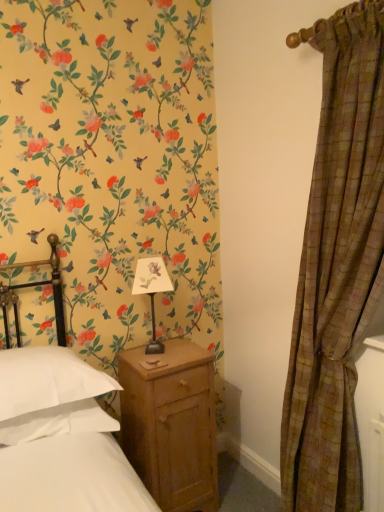
Question: Does white soft pillow at lower left turn towards matte black table lamp at center?

Choices:
 (A) yes
 (B) no

Answer: (B)

Question: Would you say white soft pillow at lower left contains matte black table lamp at center?

Choices:
 (A) no
 (B) yes

Answer: (A)

Question: Are white soft pillow at lower left and matte black table lamp at center located far from each other?

Choices:
 (A) no
 (B) yes

Answer: (A)

Question: From a real-world perspective, is white soft pillow at lower left located higher than matte black table lamp at center?

Choices:
 (A) yes
 (B) no

Answer: (B)

Question: Considering the relative sizes of white soft pillow at lower left and matte black table lamp at center in the image provided, is white soft pillow at lower left wider than matte black table lamp at center?

Choices:
 (A) no
 (B) yes

Answer: (B)

Question: In the image, is wooden nightstand at lower center positioned in front of or behind brown plaid curtain at right?

Choices:
 (A) behind
 (B) front

Answer: (A)

Question: Considering the positions of point (162, 412) and point (283, 431), is point (162, 412) closer or farther from the camera than point (283, 431)?

Choices:
 (A) farther
 (B) closer

Answer: (A)

Question: Based on their sizes in the image, would you say wooden nightstand at lower center is bigger or smaller than brown plaid curtain at right?

Choices:
 (A) small
 (B) big

Answer: (A)

Question: Considering the positions of wooden nightstand at lower center and brown plaid curtain at right in the image, is wooden nightstand at lower center wider or thinner than brown plaid curtain at right?

Choices:
 (A) wide
 (B) thin

Answer: (A)

Question: In the image, is brown plaid curtain at right positioned in front of or behind wooden nightstand at lower center?

Choices:
 (A) front
 (B) behind

Answer: (A)

Question: Is brown plaid curtain at right to the left or to the right of wooden nightstand at lower center in the image?

Choices:
 (A) right
 (B) left

Answer: (A)

Question: From a real-world perspective, is brown plaid curtain at right above or below wooden nightstand at lower center?

Choices:
 (A) above
 (B) below

Answer: (A)

Question: Based on their sizes in the image, would you say brown plaid curtain at right is bigger or smaller than wooden nightstand at lower center?

Choices:
 (A) small
 (B) big

Answer: (B)

Question: From the image's perspective, relative to brown plaid curtain at right, is matte black table lamp at center above or below?

Choices:
 (A) below
 (B) above

Answer: (A)

Question: In the image, is matte black table lamp at center positioned in front of or behind brown plaid curtain at right?

Choices:
 (A) behind
 (B) front

Answer: (A)